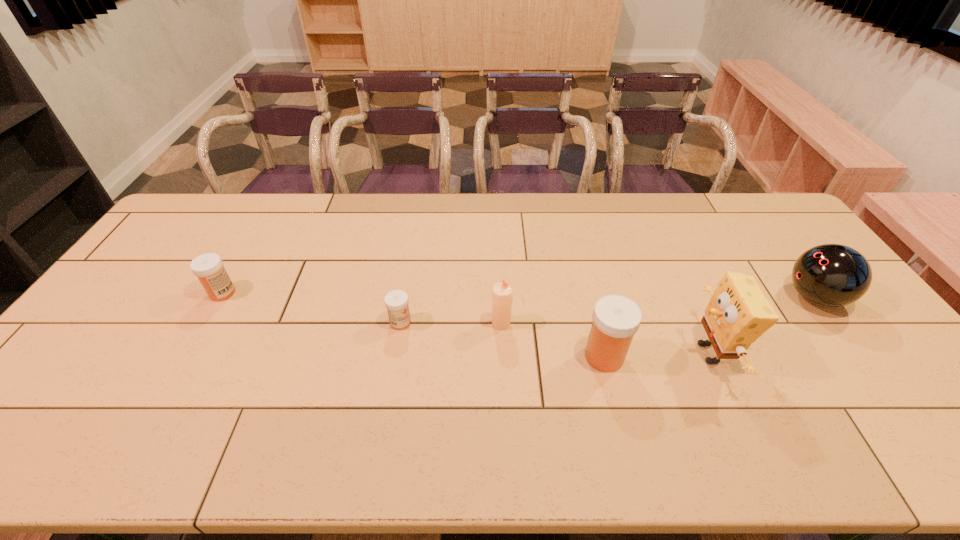
I want to click on empty location between the leftmost object and the rightmost object, so click(518, 295).

The width and height of the screenshot is (960, 540). Find the location of `vacant space in between the fifth object from left to right and the tallest medicine`. vacant space in between the fifth object from left to right and the tallest medicine is located at coordinates (657, 355).

You are a GUI agent. You are given a task and a screenshot of the screen. Output one action in this format:
    pyautogui.click(x=<x>, y=<y>)
    Task: Click on the empty space between the leftmost object and the second farthest medicine
    Image resolution: width=960 pixels, height=540 pixels.
    Given the screenshot: What is the action you would take?
    pyautogui.click(x=312, y=308)

The image size is (960, 540). I want to click on unoccupied position between the tallest object and the second farthest medicine, so (x=555, y=338).

Identify the location of the fourth closest object to the shortest object. (737, 314).

This screenshot has width=960, height=540. What are the coordinates of `object identified as the second closest to the second tallest medicine` in the screenshot? It's located at (502, 294).

This screenshot has height=540, width=960. I want to click on the closest medicine to the rightmost medicine, so click(396, 301).

Select which medicine is the second closest to the leftmost medicine. Please provide its 2D coordinates. Your answer should be formatted as a tuple, i.e. [(x, y)], where the tuple contains the x and y coordinates of a point satisfying the conditions above.

[(616, 319)]

This screenshot has height=540, width=960. What are the coordinates of `vacant position in the image that satisfies the following two spatial constraints: 1. on the surface of the rightmost object near the finger holes; 2. on the front side of the rightmost medicine` in the screenshot? It's located at (858, 356).